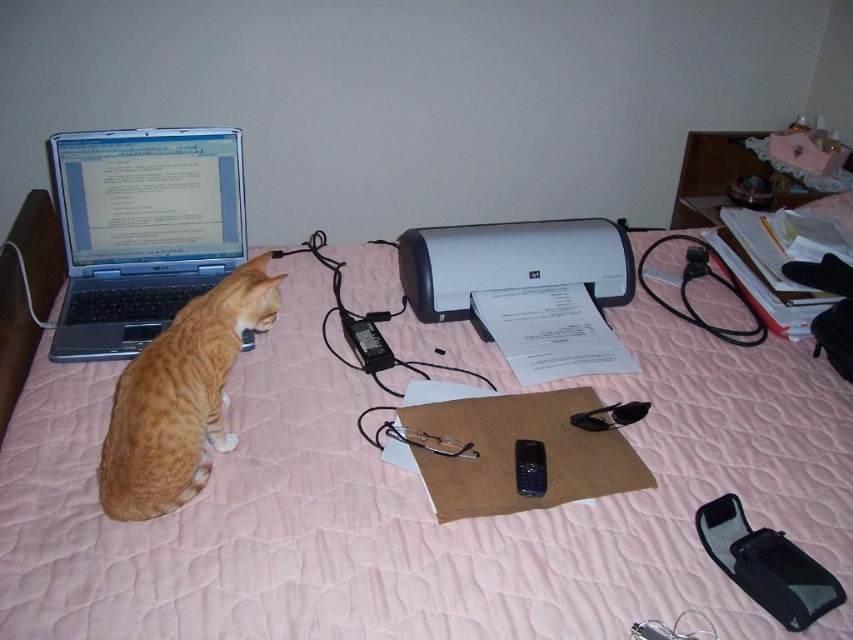
Does matte silver laptop at left have a greater width compared to black plastic phone at center?

Indeed, matte silver laptop at left has a greater width compared to black plastic phone at center.

Does matte silver laptop at left have a lesser height compared to black plastic phone at center?

No, matte silver laptop at left is not shorter than black plastic phone at center.

What do you see at coordinates (142, 230) in the screenshot?
I see `matte silver laptop at left` at bounding box center [142, 230].

The height and width of the screenshot is (640, 853). I want to click on matte silver laptop at left, so click(142, 230).

Is point (160, 433) in front of point (531, 461)?

Yes, point (160, 433) is closer to viewer.

Does orange fur cat at left appear over black plastic phone at center?

Indeed, orange fur cat at left is positioned over black plastic phone at center.

Where is `orange fur cat at left`? The height and width of the screenshot is (640, 853). orange fur cat at left is located at coordinates (180, 397).

Which is in front, point (218, 422) or point (415, 276)?

Positioned in front is point (218, 422).

Does orange fur cat at left have a greater width compared to white plastic printer at center?

In fact, orange fur cat at left might be narrower than white plastic printer at center.

The image size is (853, 640). Describe the element at coordinates (180, 397) in the screenshot. I see `orange fur cat at left` at that location.

Where is `orange fur cat at left`? Image resolution: width=853 pixels, height=640 pixels. orange fur cat at left is located at coordinates (180, 397).